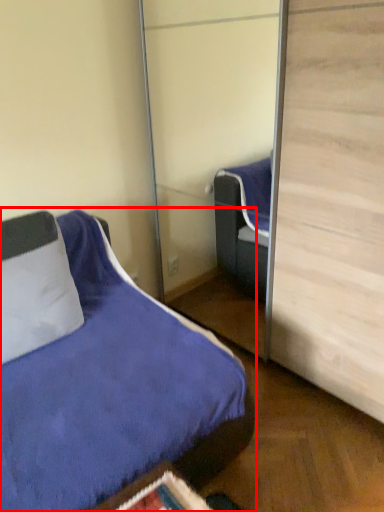
Question: In this image, where is bed (annotated by the red box) located relative to pillow?

Choices:
 (A) right
 (B) left

Answer: (A)